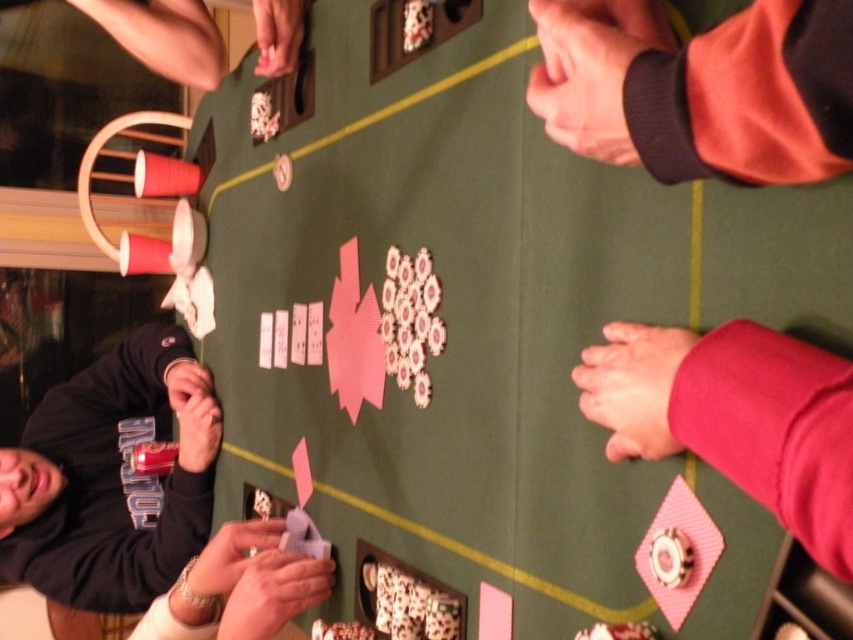
You are a dealer at the poker table. You need to place a new chip pile between the black fabric shirt at lower left and the pink fabric hand at lower right. Which side should you place it closer to the wider object?

The black fabric shirt at lower left is wider than the pink fabric hand at lower right, so you should place the new chip pile closer to the black fabric shirt at lower left.

You are a spectator at the card game table. You notice the pink fabric hand at lower right and the smooth gray cards at lower center. Which object is shorter in height?

The pink fabric hand at lower right is shorter in height than the smooth gray cards at lower center because the description states that the pink fabric hand is not as tall as the smooth gray cards.

You are a spectator at the card game table. You notice the black fabric shirt at lower left and the pink fabric hand at lower right. Which object is positioned lower on the table?

The black fabric shirt at lower left is located below the pink fabric hand at lower right, so it is positioned lower on the table.